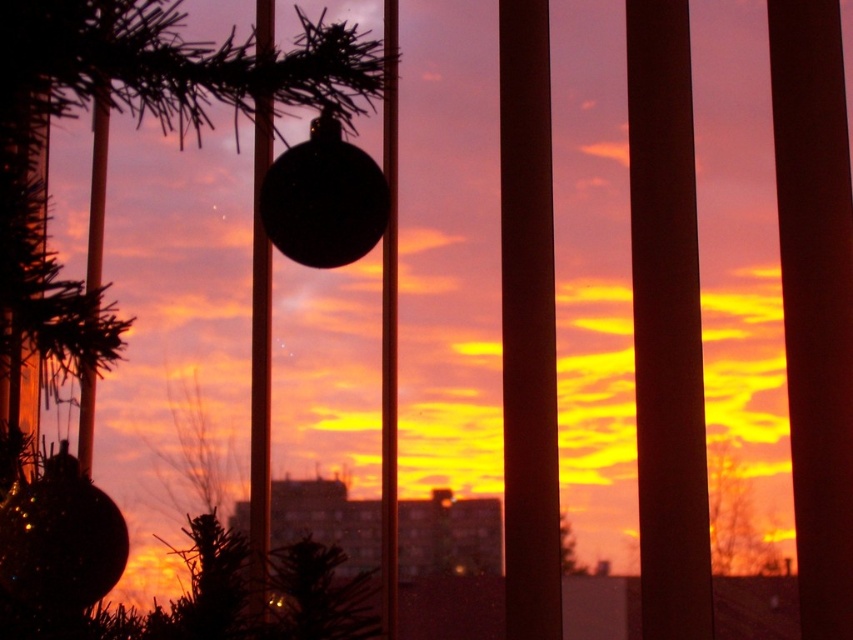
Which is more to the left, shiny metallic ornament at upper center or green matte tree at center?

Positioned to the left is shiny metallic ornament at upper center.

How distant is shiny metallic ornament at upper center from green matte tree at center?

shiny metallic ornament at upper center is 30.13 inches away from green matte tree at center.

The height and width of the screenshot is (640, 853). Find the location of `shiny metallic ornament at upper center`. shiny metallic ornament at upper center is located at coordinates (137, 122).